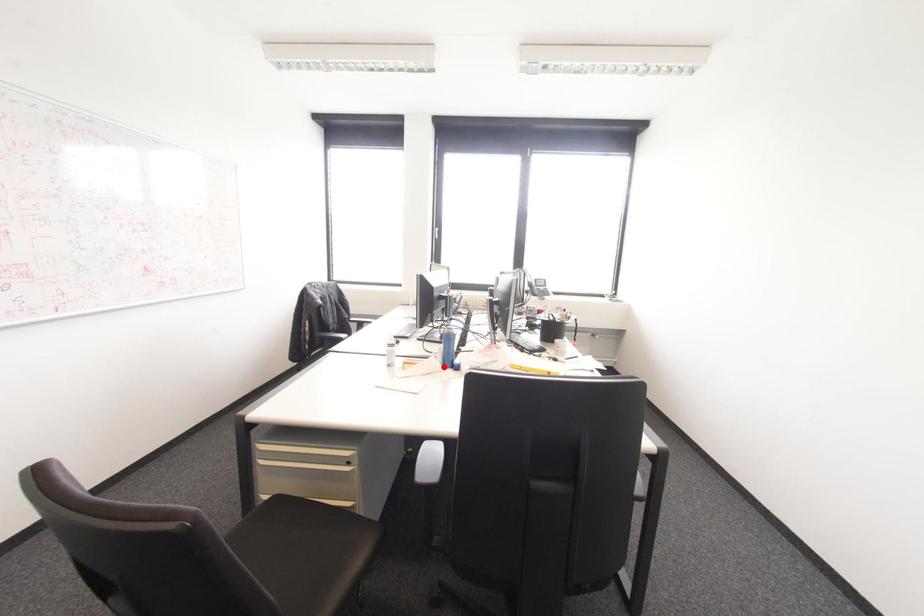
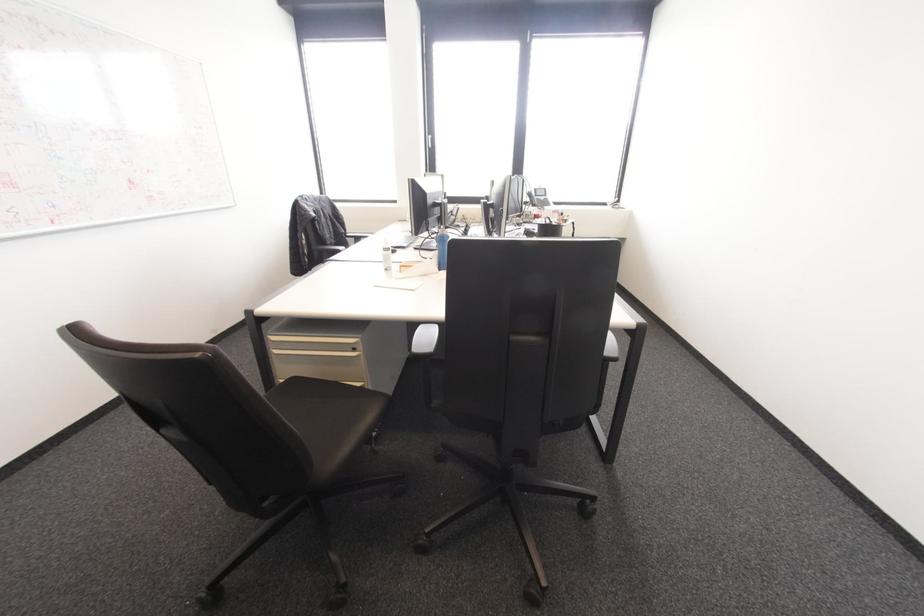
Where in the second image is the point corresponding to the highlighted location from the first image?

(440, 270)